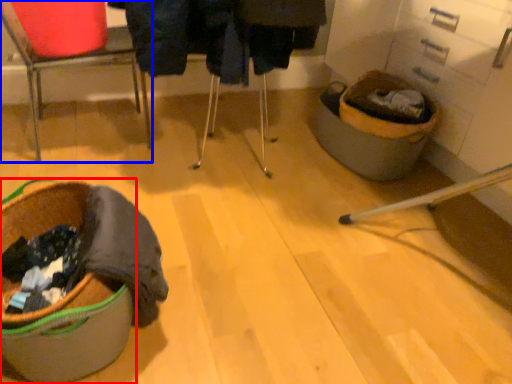
Question: Which point is further to the camera, laundry basket (highlighted by a red box) or chair (highlighted by a blue box)?

Choices:
 (A) laundry basket
 (B) chair

Answer: (B)